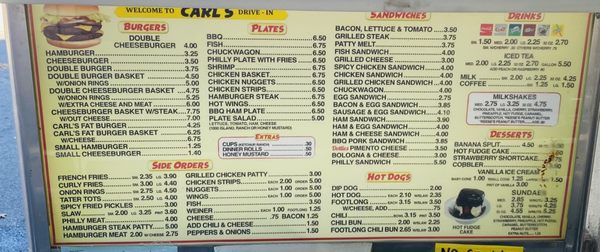
Image resolution: width=600 pixels, height=252 pixels. Find the location of `plates`. plates is located at coordinates (260, 26).